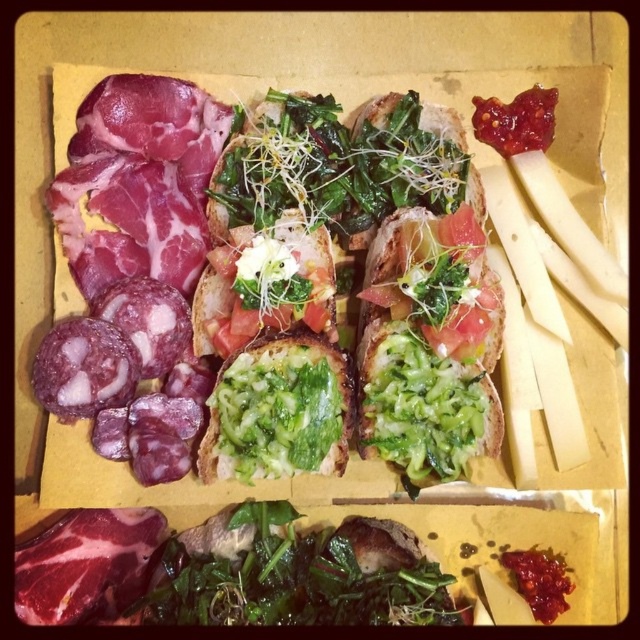
Who is lower down, green leafy vegetable at center or green leafymaterial/texturevegetable at center?

green leafymaterial/texturevegetable at center is below.

I want to click on green leafy vegetable at center, so [422, 406].